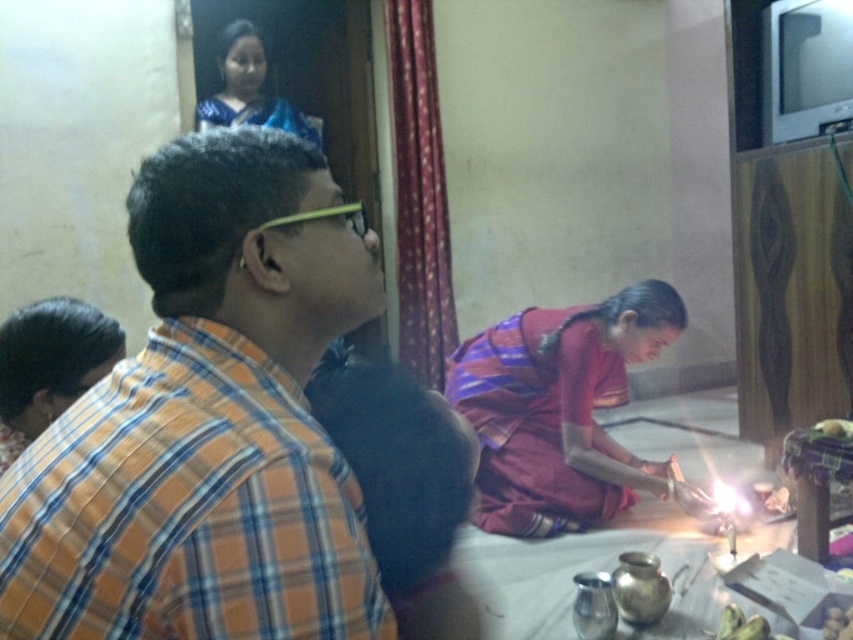
Is orange plaid shirt at left wider than dark brown hair at lower left?

Indeed, orange plaid shirt at left has a greater width compared to dark brown hair at lower left.

Between orange plaid shirt at left and dark brown hair at lower left, which one has less height?

dark brown hair at lower left

Locate an element on the screen. The width and height of the screenshot is (853, 640). orange plaid shirt at left is located at coordinates (207, 422).

In the scene shown: Between maroon silk saree at lower center and dark brown hair at lower left, which one is positioned higher?

dark brown hair at lower left is above.

Does maroon silk saree at lower center have a greater width compared to dark brown hair at lower left?

Indeed, maroon silk saree at lower center has a greater width compared to dark brown hair at lower left.

Between point (521, 484) and point (111, 337), which one is positioned in front?

Point (111, 337) is more forward.

The width and height of the screenshot is (853, 640). Find the location of `maroon silk saree at lower center`. maroon silk saree at lower center is located at coordinates (561, 410).

Is maroon silk saree at lower center below white glossy food at lower right?

Yes.

Consider the image. Who is positioned more to the right, maroon silk saree at lower center or white glossy food at lower right?

white glossy food at lower right is more to the right.

Between point (531, 532) and point (827, 426), which one is positioned in front?

Positioned in front is point (827, 426).

At what (x,y) coordinates should I click in order to perform the action: click on maroon silk saree at lower center. Please return your answer as a coordinate pair (x, y). Looking at the image, I should click on (561, 410).